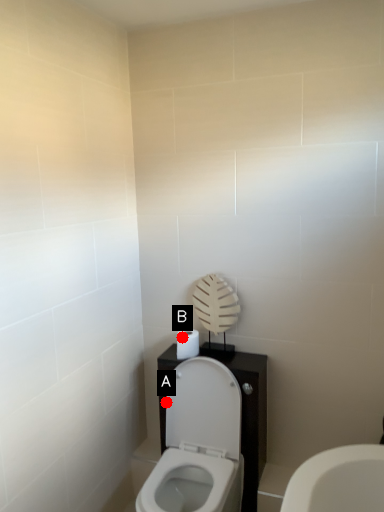
Question: Two points are circled on the image, labeled by A and B beside each circle. Which point is farther from the camera taking this photo?

Choices:
 (A) A is further
 (B) B is further

Answer: (B)